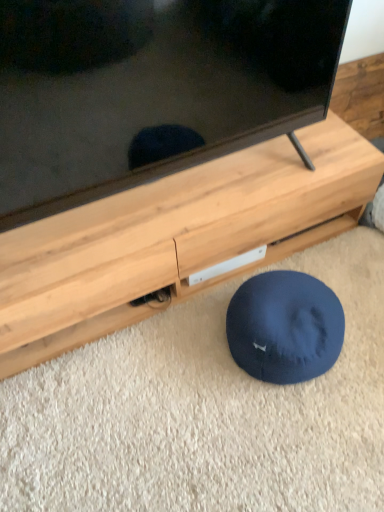
This screenshot has width=384, height=512. I want to click on vacant space underneath black glossy tv at upper center (from a real-world perspective), so click(x=177, y=192).